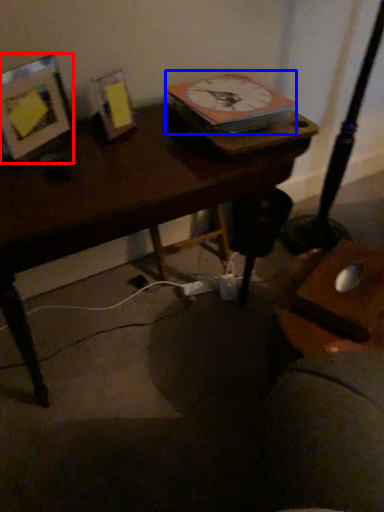
Question: Which object is closer to the camera taking this photo, picture frame (highlighted by a red box) or clock (highlighted by a blue box)?

Choices:
 (A) picture frame
 (B) clock

Answer: (A)